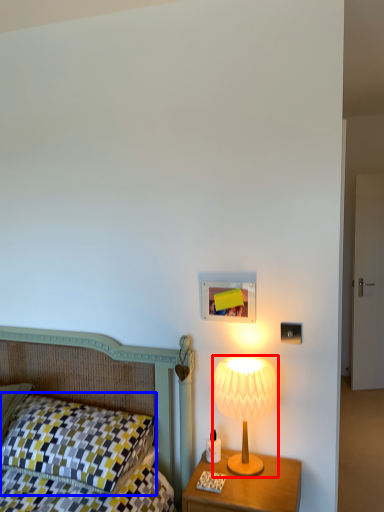
Question: Among these objects, which one is nearest to the camera, lamp (highlighted by a red box) or pillow (highlighted by a blue box)?

Choices:
 (A) lamp
 (B) pillow

Answer: (B)